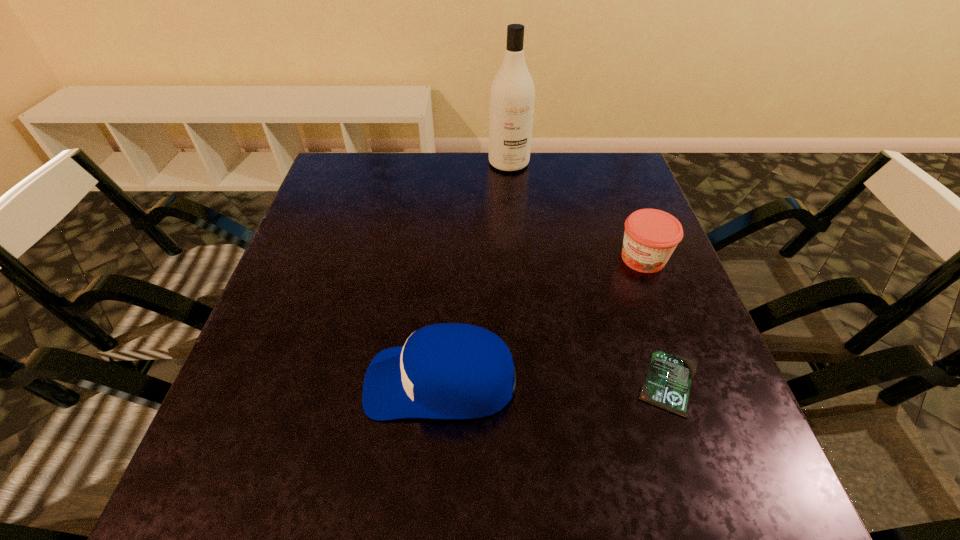
At what (x,y) coordinates should I click in order to perform the action: click on unoccupied area between the jam and the baseball cap. Please return your answer as a coordinate pair (x, y). Looking at the image, I should click on (542, 320).

Identify the location of free space between the shortest object and the tallest object. (589, 273).

The image size is (960, 540). I want to click on free space between the baseball cap and the farthest object, so click(475, 272).

You are a GUI agent. You are given a task and a screenshot of the screen. Output one action in this format:
    pyautogui.click(x=<x>, y=<y>)
    Task: Click on the free space between the jam and the tallest object
    This screenshot has height=540, width=960.
    Given the screenshot: What is the action you would take?
    pyautogui.click(x=576, y=211)

Find the location of a particular element. This screenshot has width=960, height=540. empty space that is in between the tallest object and the jam is located at coordinates (576, 211).

Identify the location of free spot between the shampoo and the identity card. This screenshot has width=960, height=540. (589, 273).

At what (x,y) coordinates should I click in order to perform the action: click on object that is the second nearest to the tallest object. Please return your answer as a coordinate pair (x, y). Looking at the image, I should click on (449, 370).

You are a GUI agent. You are given a task and a screenshot of the screen. Output one action in this format:
    pyautogui.click(x=<x>, y=<y>)
    Task: Click on the second closest object to the jam
    This screenshot has width=960, height=540.
    Given the screenshot: What is the action you would take?
    pyautogui.click(x=449, y=370)

I want to click on vacant space that satisfies the following two spatial constraints: 1. on the front side of the shampoo; 2. on the left side of the jam, so click(516, 258).